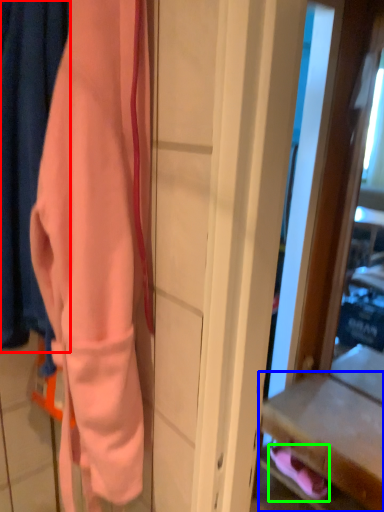
Question: Which is nearer to the curtain (highlighted by a red box)? drawer (highlighted by a blue box) or footwear (highlighted by a green box).

Choices:
 (A) drawer
 (B) footwear

Answer: (A)